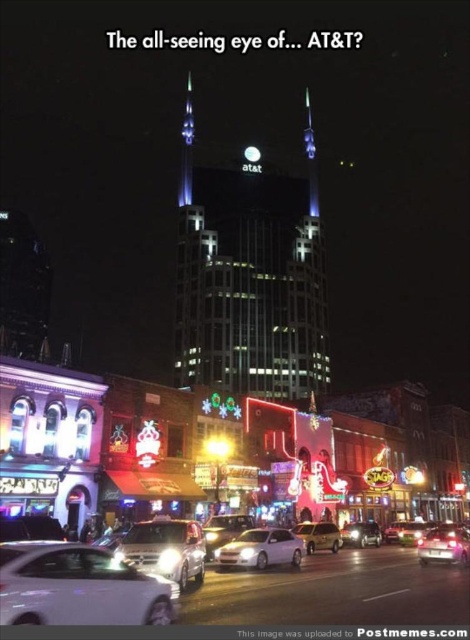
Question: Which object is the farthest from the white glossy sedan at lower left?

Choices:
 (A) shiny silver sedan at center
 (B) white matte sedan at center

Answer: (A)

Question: Can you confirm if glossy metallic car at lower right is thinner than shiny silver sedan at center?

Choices:
 (A) yes
 (B) no

Answer: (B)

Question: Is white matte sedan at center smaller than shiny silver sedan at center?

Choices:
 (A) yes
 (B) no

Answer: (B)

Question: Which point appears closest to the camera in this image?

Choices:
 (A) (352, 528)
 (B) (7, 564)

Answer: (B)

Question: Which object appears farthest from the camera in this image?

Choices:
 (A) shiny silver sedan at center
 (B) white glossy sedan at center
 (C) shiny gold car at center
 (D) white matte sedan at center

Answer: (A)

Question: Does white glossy sedan at lower left have a smaller size compared to satin silver sedan at lower center?

Choices:
 (A) no
 (B) yes

Answer: (B)